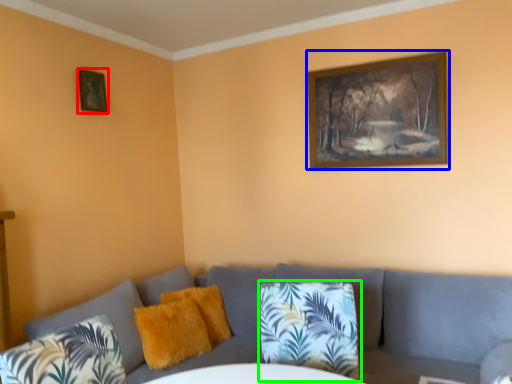
Question: Which object is the closest to the picture frame (highlighted by a red box)? Choose among these: picture frame (highlighted by a blue box) or pillow (highlighted by a green box).

Choices:
 (A) picture frame
 (B) pillow

Answer: (A)